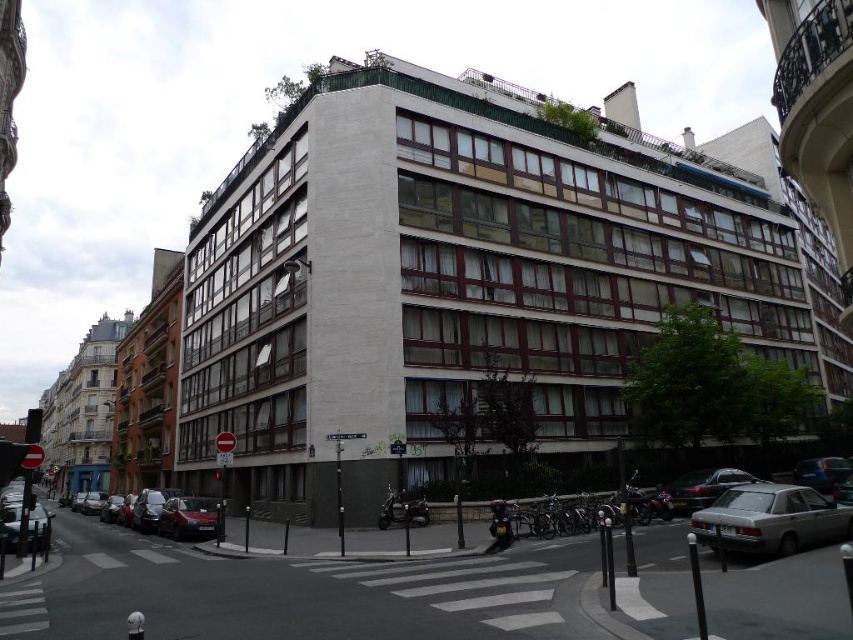
Question: Which point is closer to the camera?

Choices:
 (A) (160, 500)
 (B) (705, 490)

Answer: (B)

Question: Is silver metallic sedan at lower right bigger than shiny silver car at lower left?

Choices:
 (A) yes
 (B) no

Answer: (B)

Question: Which of the following is the closest to the observer?

Choices:
 (A) (703, 488)
 (B) (207, 508)
 (C) (9, 513)

Answer: (C)

Question: Which is nearer to the shiny silver car at lower left?

Choices:
 (A) shiny red car at lower left
 (B) metallic silver car at lower right

Answer: (A)

Question: Can you confirm if metallic silver car at lower right is bigger than shiny red car at lower left?

Choices:
 (A) yes
 (B) no

Answer: (B)

Question: Is metallic silver car at lower right to the right of shiny red car at lower left from the viewer's perspective?

Choices:
 (A) no
 (B) yes

Answer: (B)